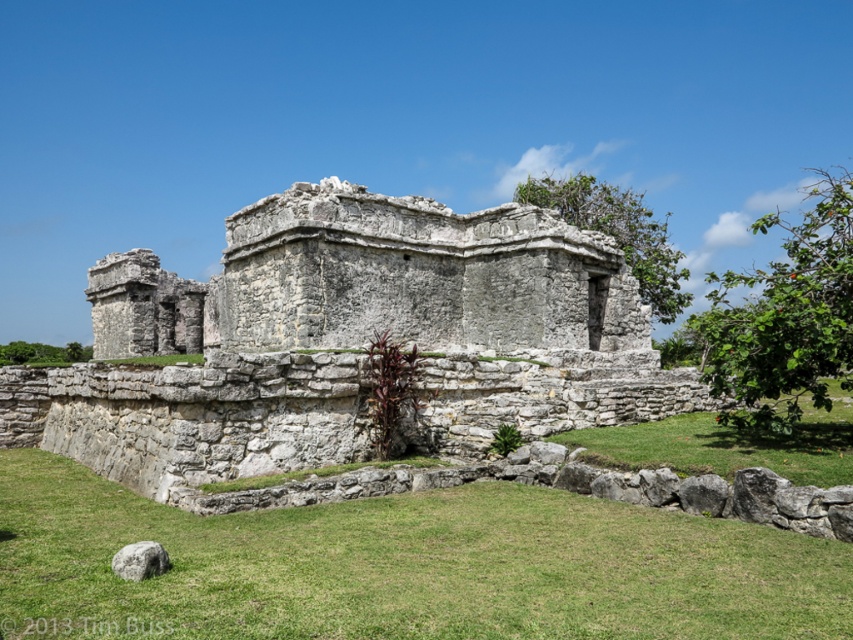
You are an archaeologist examining the ancient stone structure. You notice a gray stone ruins at center and a transparent watermark at lower left. Which object is positioned higher in the image?

The gray stone ruins at center is positioned higher than the transparent watermark at lower left.

You are a tourist standing in front of the gray stone ruins at center and the transparent watermark at lower left. Which object is closer to you?

The gray stone ruins at center is closer to you than the transparent watermark at lower left because it is further to the viewer according to the description.